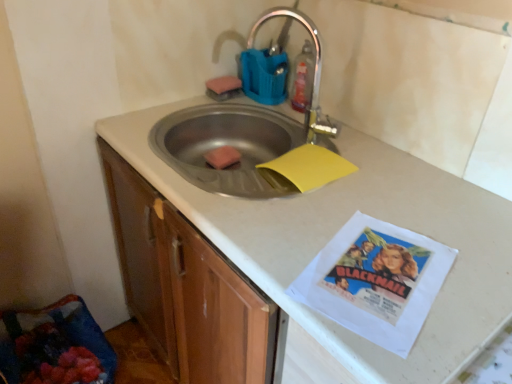
Question: Is yellow matte paper at sink taller than pink sponge at sink, the first food ordered from the bottom?

Choices:
 (A) yes
 (B) no

Answer: (B)

Question: From a real-world perspective, is yellow matte paper at sink physically above pink sponge at sink, the second food when ordered from top to bottom?

Choices:
 (A) no
 (B) yes

Answer: (B)

Question: Is yellow matte paper at sink looking in the opposite direction of pink sponge at sink, the second food when ordered from top to bottom?

Choices:
 (A) no
 (B) yes

Answer: (A)

Question: Can you confirm if yellow matte paper at sink is smaller than pink sponge at sink, the first food ordered from the bottom?

Choices:
 (A) yes
 (B) no

Answer: (B)

Question: Is yellow matte paper at sink surrounding pink sponge at sink, the first food ordered from the bottom?

Choices:
 (A) no
 (B) yes

Answer: (A)

Question: In the image, is translucent plastic bottle at upper center positioned in front of or behind white matte countertop at center?

Choices:
 (A) front
 (B) behind

Answer: (B)

Question: Is translucent plastic bottle at upper center bigger or smaller than white matte countertop at center?

Choices:
 (A) small
 (B) big

Answer: (A)

Question: Would you say translucent plastic bottle at upper center is to the left or to the right of white matte countertop at center in the picture?

Choices:
 (A) left
 (B) right

Answer: (B)

Question: From a real-world perspective, is translucent plastic bottle at upper center above or below white matte countertop at center?

Choices:
 (A) above
 (B) below

Answer: (A)

Question: In terms of width, does pink sponge at sink, the second food when ordered from top to bottom, look wider or thinner when compared to white matte countertop at center?

Choices:
 (A) wide
 (B) thin

Answer: (B)

Question: Considering the positions of point (226, 157) and point (414, 377), is point (226, 157) closer or farther from the camera than point (414, 377)?

Choices:
 (A) closer
 (B) farther

Answer: (B)

Question: Would you say pink sponge at sink, the second food when ordered from top to bottom, is to the left or to the right of white matte countertop at center in the picture?

Choices:
 (A) right
 (B) left

Answer: (B)

Question: From the image's perspective, is pink sponge at sink, the second food when ordered from top to bottom, located above or below white matte countertop at center?

Choices:
 (A) below
 (B) above

Answer: (B)

Question: Relative to translucent plastic bottle at upper center, is yellow matte paper at sink in front or behind?

Choices:
 (A) behind
 (B) front

Answer: (B)

Question: From their relative heights in the image, would you say yellow matte paper at sink is taller or shorter than translucent plastic bottle at upper center?

Choices:
 (A) short
 (B) tall

Answer: (A)